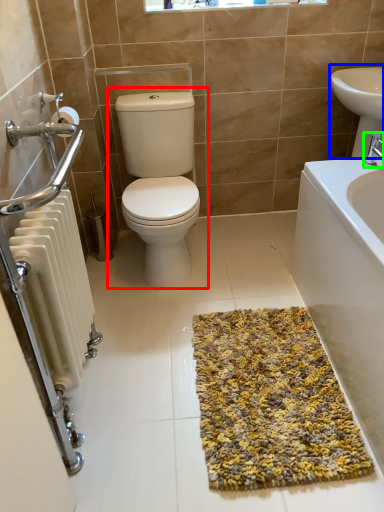
Question: Which object is the farthest from toilet (highlighted by a red box)? Choose among these: sink (highlighted by a blue box) or tap (highlighted by a green box).

Choices:
 (A) sink
 (B) tap

Answer: (B)